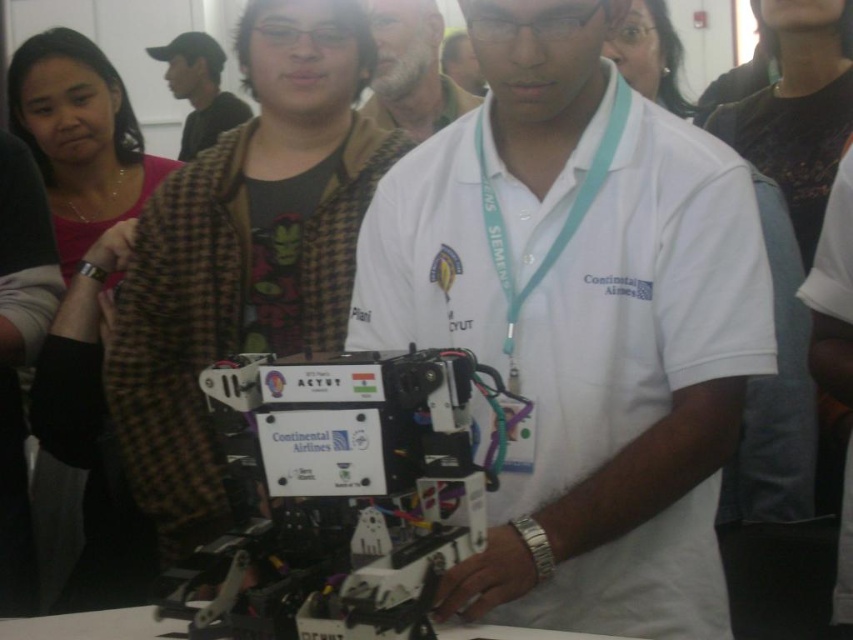
Can you confirm if white cotton shirt at center is wider than white beard at center?

Yes.

Which is in front, point (548, 10) or point (415, 116)?

Point (548, 10)

Which is behind, point (712, 560) or point (376, 4)?

The point (376, 4) is behind.

Where is `white cotton shirt at center`? This screenshot has height=640, width=853. white cotton shirt at center is located at coordinates (579, 323).

Is point (164, 195) more distant than point (193, 67)?

No, (164, 195) is in front of (193, 67).

Is brown checkered lab coat at center further to the viewer compared to brown checkered jacket at upper left?

That is False.

Does point (154, 196) come behind point (207, 113)?

No, (154, 196) is in front of (207, 113).

Find the location of `brown checkered lab coat at center`. brown checkered lab coat at center is located at coordinates pyautogui.click(x=219, y=316).

Is white beard at center to the right of brown checkered jacket at upper left from the viewer's perspective?

Correct, you'll find white beard at center to the right of brown checkered jacket at upper left.

Can you confirm if white beard at center is positioned below brown checkered jacket at upper left?

Correct, white beard at center is located below brown checkered jacket at upper left.

Does point (445, 99) come closer to viewer compared to point (190, 35)?

Yes, point (445, 99) is closer to viewer.

What are the coordinates of `white beard at center` in the screenshot? It's located at (410, 68).